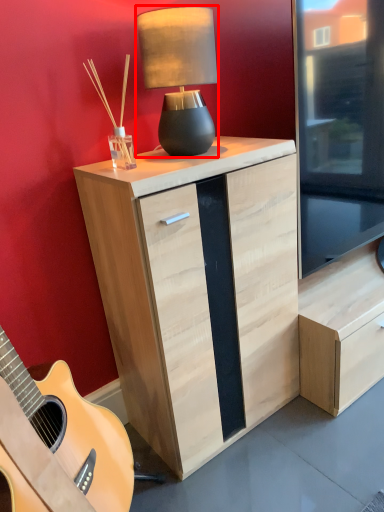
Question: From the image's perspective, considering the relative positions of lamp (annotated by the red box) and chest of drawers in the image provided, where is lamp (annotated by the red box) located with respect to the staircase?

Choices:
 (A) above
 (B) below

Answer: (A)